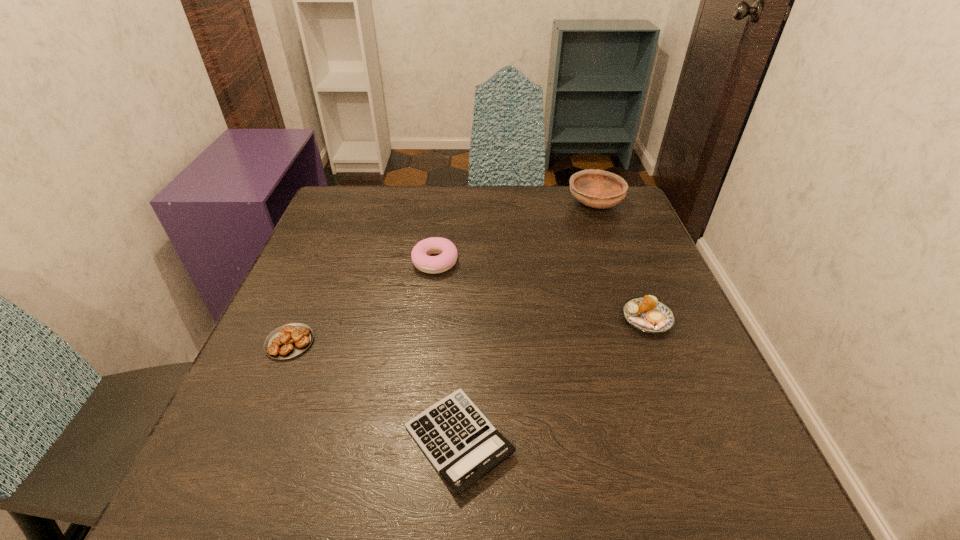
Where is `free area in between the second pastry from left to right and the leftmost object`? The image size is (960, 540). free area in between the second pastry from left to right and the leftmost object is located at coordinates (363, 302).

Locate an element on the screen. vacant area that lies between the shortest object and the second pastry from left to right is located at coordinates (447, 351).

Find the location of `vacant region between the second shortest object and the nearest object`. vacant region between the second shortest object and the nearest object is located at coordinates (374, 391).

Locate an element on the screen. The image size is (960, 540). vacant area between the farthest pastry and the second tallest pastry is located at coordinates (541, 291).

The width and height of the screenshot is (960, 540). I want to click on unoccupied area between the second farthest object and the leftmost pastry, so click(363, 302).

Select which object appears as the fourth closest to the farthest pastry. Please provide its 2D coordinates. Your answer should be formatted as a tuple, i.e. [(x, y)], where the tuple contains the x and y coordinates of a point satisfying the conditions above.

[(648, 314)]

Identify which object is located as the second nearest to the bowl. Please provide its 2D coordinates. Your answer should be formatted as a tuple, i.e. [(x, y)], where the tuple contains the x and y coordinates of a point satisfying the conditions above.

[(420, 253)]

Identify the location of pastry identified as the closest to the second shortest pastry. (420, 253).

The height and width of the screenshot is (540, 960). Identify the location of pastry identified as the closest to the second pastry from right to left. (290, 340).

Where is `vacant space that satisfies the following two spatial constraints: 1. on the front side of the second shortest pastry; 2. on the left side of the bowl`? This screenshot has height=540, width=960. vacant space that satisfies the following two spatial constraints: 1. on the front side of the second shortest pastry; 2. on the left side of the bowl is located at coordinates (638, 319).